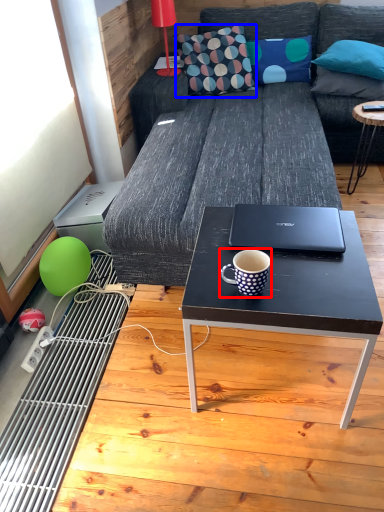
Question: Which object is closer to the camera taking this photo, coffee cup (highlighted by a red box) or throw pillow (highlighted by a blue box)?

Choices:
 (A) coffee cup
 (B) throw pillow

Answer: (A)